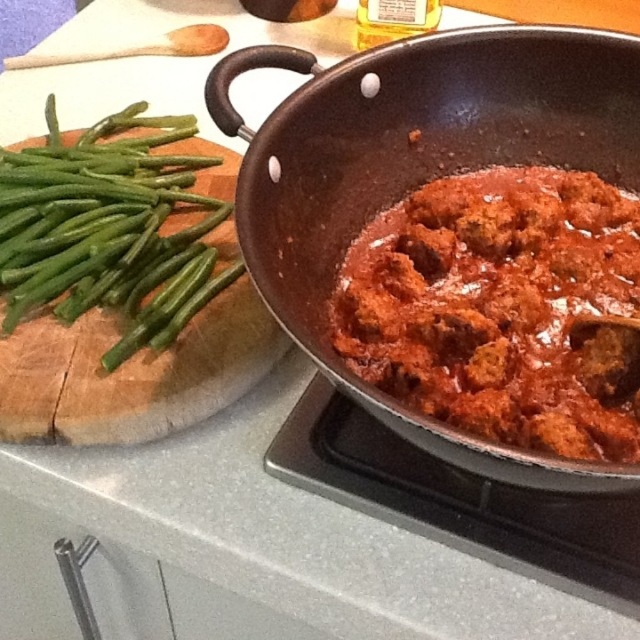
Question: Which point is farther from the camera taking this photo?

Choices:
 (A) (428, 115)
 (B) (173, 170)

Answer: (B)

Question: Can you confirm if dark brown matte wok at right is positioned to the right of green smooth/woody green beans at left?

Choices:
 (A) yes
 (B) no

Answer: (A)

Question: Which object appears farthest from the camera in this image?

Choices:
 (A) dark brown matte wok at right
 (B) green smooth/woody green beans at left

Answer: (B)

Question: Does dark brown matte wok at right appear over green smooth/woody green beans at left?

Choices:
 (A) no
 (B) yes

Answer: (A)

Question: Is the position of dark brown matte wok at right more distant than that of green smooth/woody green beans at left?

Choices:
 (A) no
 (B) yes

Answer: (A)